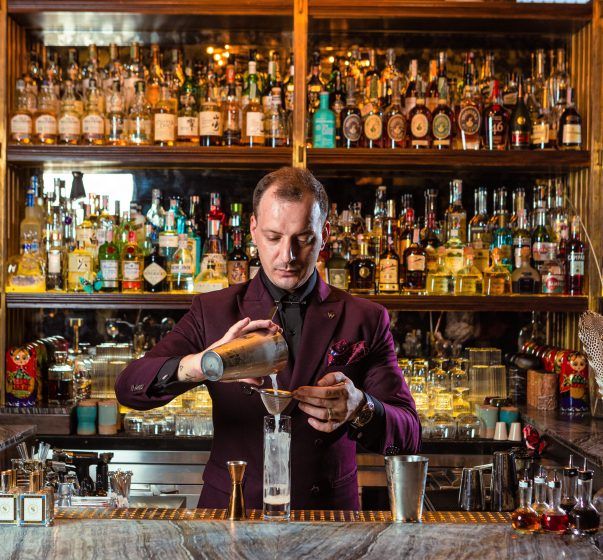
The height and width of the screenshot is (560, 603). I want to click on mixer, so click(x=400, y=482).